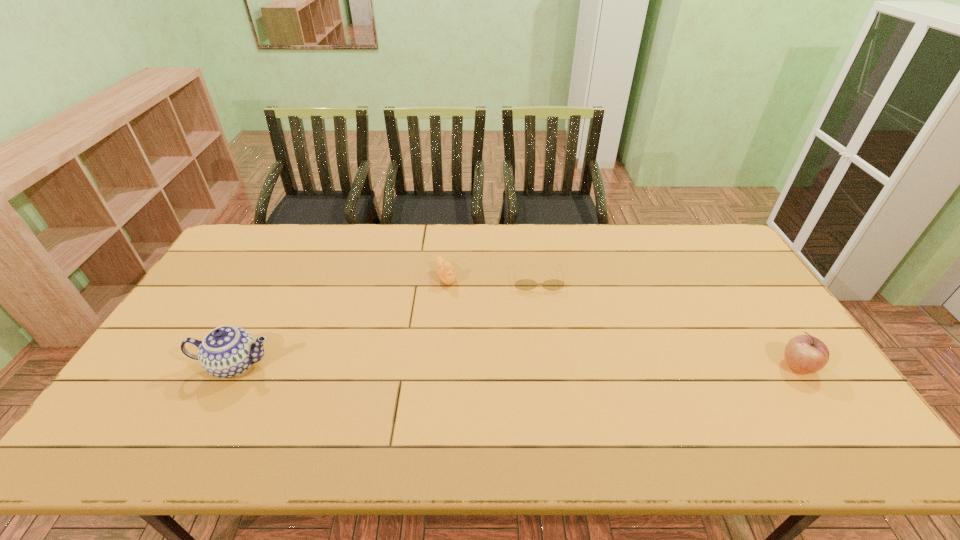
At what (x,y) coordinates should I click in order to perform the action: click on object identified as the second closest to the third shortest object. Please return your answer as a coordinate pair (x, y). This screenshot has height=540, width=960. Looking at the image, I should click on (446, 273).

Identify which object is the nearest to the leftmost object. Please provide its 2D coordinates. Your answer should be formatted as a tuple, i.e. [(x, y)], where the tuple contains the x and y coordinates of a point satisfying the conditions above.

[(446, 273)]

Where is `blank space that satisfies the following two spatial constraints: 1. at the spout of the tallest object; 2. on the right side of the third shortest object`? The height and width of the screenshot is (540, 960). blank space that satisfies the following two spatial constraints: 1. at the spout of the tallest object; 2. on the right side of the third shortest object is located at coordinates (235, 366).

Image resolution: width=960 pixels, height=540 pixels. In order to click on vacant space that satisfies the following two spatial constraints: 1. on the front side of the rightmost object; 2. on the left side of the sunglasses in this screenshot , I will do `click(550, 366)`.

The image size is (960, 540). What are the coordinates of `blank space that satisfies the following two spatial constraints: 1. on the front side of the duckling; 2. on the right side of the sunglasses` in the screenshot? It's located at (445, 279).

This screenshot has width=960, height=540. I want to click on vacant space that satisfies the following two spatial constraints: 1. on the front side of the third object from right to left; 2. on the right side of the apple, so click(x=438, y=366).